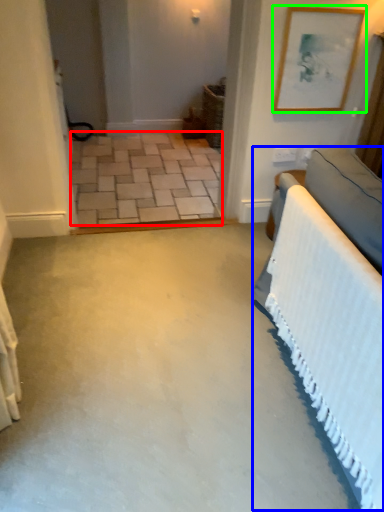
Question: Based on their relative distances, which object is nearer to concrete (highlighted by a red box)? Choose from bed (highlighted by a blue box) and picture frame (highlighted by a green box).

Choices:
 (A) bed
 (B) picture frame

Answer: (B)